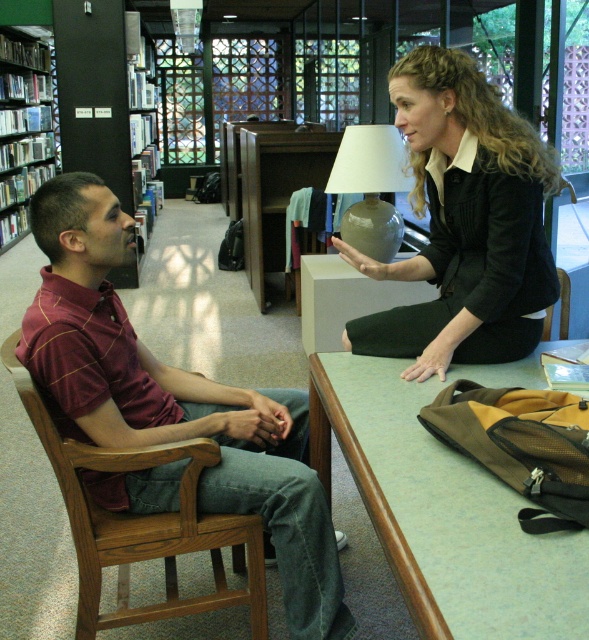
Question: Does matte ceramic lamp at center appear on the left side of brown wood chair at lower right?

Choices:
 (A) yes
 (B) no

Answer: (A)

Question: Which point appears farthest from the camera in this image?

Choices:
 (A) (402, 230)
 (B) (411, 538)
 (C) (263, 580)
 (D) (41, 180)

Answer: (D)

Question: Considering the relative positions of green laminate table at center and brown wood chair at left in the image provided, where is green laminate table at center located with respect to brown wood chair at left?

Choices:
 (A) above
 (B) below

Answer: (A)

Question: Estimate the real-world distances between objects in this image. Which object is farther from the matte ceramic lamp at center?

Choices:
 (A) green laminate table at center
 (B) matte black jacket at upper right
 (C) matte plastic bookshelf at left

Answer: (C)

Question: Which object is closer to the camera taking this photo?

Choices:
 (A) maroon striped shirt at left
 (B) green laminate table at center
 (C) brown wood chair at left

Answer: (B)

Question: Is matte plastic bookshelf at left further to camera compared to brown wood chair at lower right?

Choices:
 (A) yes
 (B) no

Answer: (A)